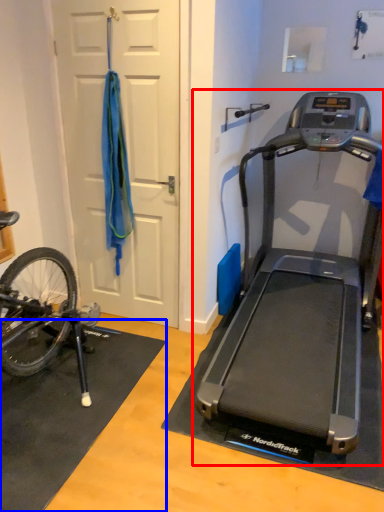
Question: Which object appears closest to the camera in this image, treadmill (highlighted by a red box) or doormat (highlighted by a blue box)?

Choices:
 (A) treadmill
 (B) doormat

Answer: (A)